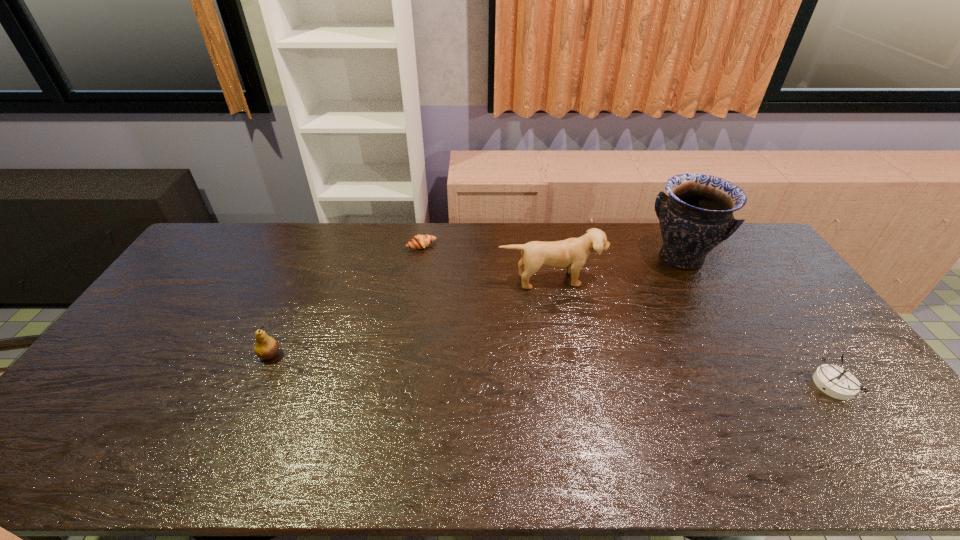
Locate an element on the screen. This screenshot has width=960, height=540. free spot between the third tallest object and the pottery is located at coordinates click(475, 306).

At what (x,y) coordinates should I click in order to perform the action: click on empty location between the pastry and the rightmost object. Please return your answer as a coordinate pair (x, y). Image resolution: width=960 pixels, height=540 pixels. Looking at the image, I should click on (628, 315).

The image size is (960, 540). I want to click on vacant area between the nearest object and the pottery, so click(757, 321).

Image resolution: width=960 pixels, height=540 pixels. Find the location of `blank region between the pear and the second shortest object`. blank region between the pear and the second shortest object is located at coordinates (552, 370).

In order to click on free point between the compass and the leftmost object in this screenshot , I will do `click(552, 370)`.

Locate an element on the screen. free space that is in between the second nearest object and the puppy is located at coordinates (411, 317).

You are a GUI agent. You are given a task and a screenshot of the screen. Output one action in this format:
    pyautogui.click(x=<x>, y=<y>)
    Task: Click on the free point between the pastry and the nearest object
    This screenshot has width=960, height=540.
    Given the screenshot: What is the action you would take?
    pyautogui.click(x=628, y=315)

Identify the location of unoccupied area between the tallest object and the second shortest object. This screenshot has width=960, height=540. (757, 321).

I want to click on the second closest object to the third object from right to left, so click(419, 241).

At what (x,y) coordinates should I click in order to perform the action: click on object identified as the fourth closest to the pastry. Please return your answer as a coordinate pair (x, y). Image resolution: width=960 pixels, height=540 pixels. Looking at the image, I should click on (833, 380).